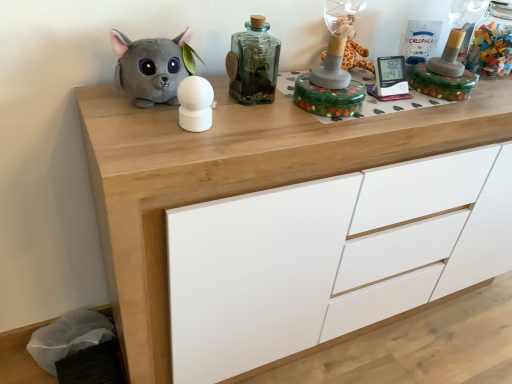
Locate an element on the screen. The width and height of the screenshot is (512, 384). vacant space behind white matte sphere at center, the 2th toy from the left is located at coordinates (230, 104).